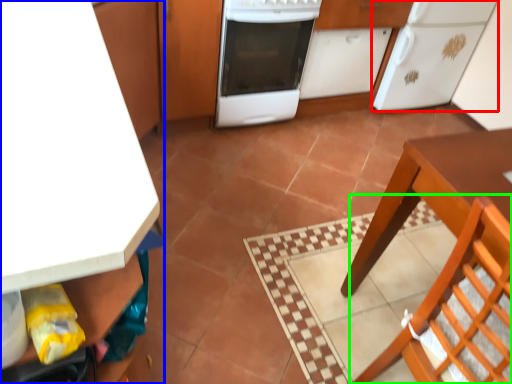
Question: Which object is the closest to the kitchen appliance (highlighted by a red box)? Choose among these: cabinetry (highlighted by a blue box) or chair (highlighted by a green box).

Choices:
 (A) cabinetry
 (B) chair

Answer: (B)